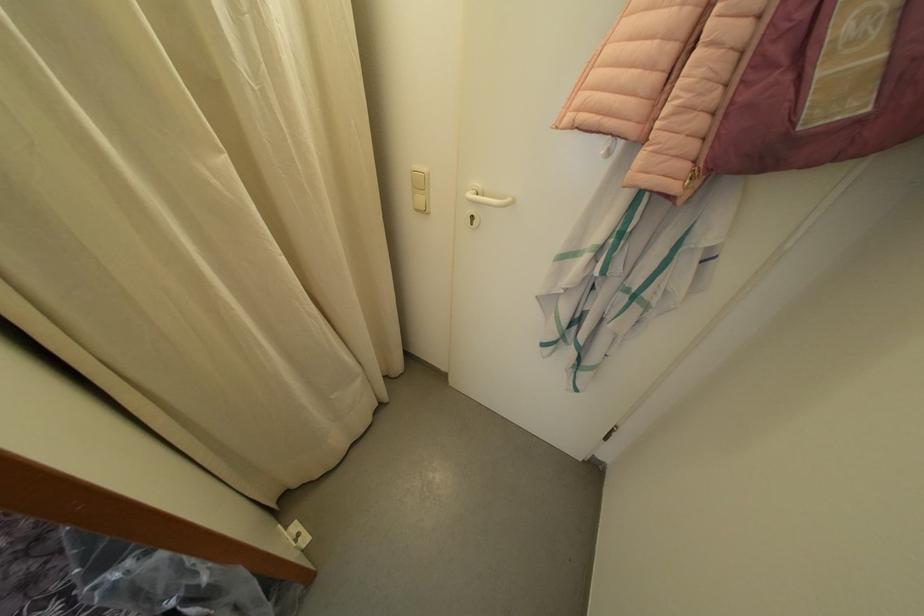
Find where to pull the white door handle. Please return your answer as a coordinate pair (x, y).

(485, 198)